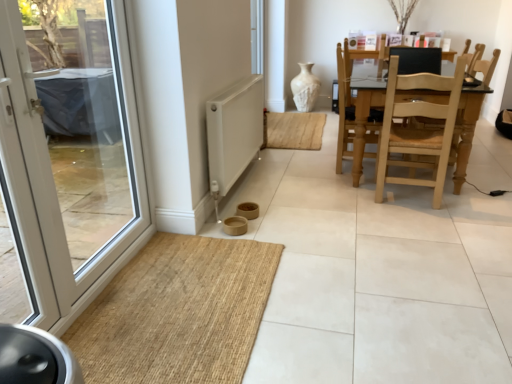
Where is `free area below light wood/wooden chair at right (from a real-world perspective)`? This screenshot has width=512, height=384. free area below light wood/wooden chair at right (from a real-world perspective) is located at coordinates (415, 200).